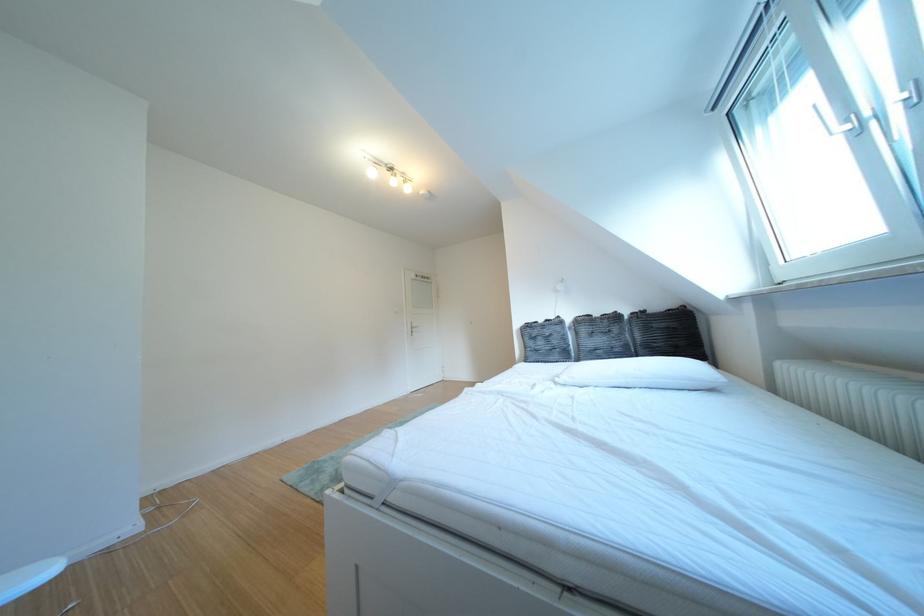
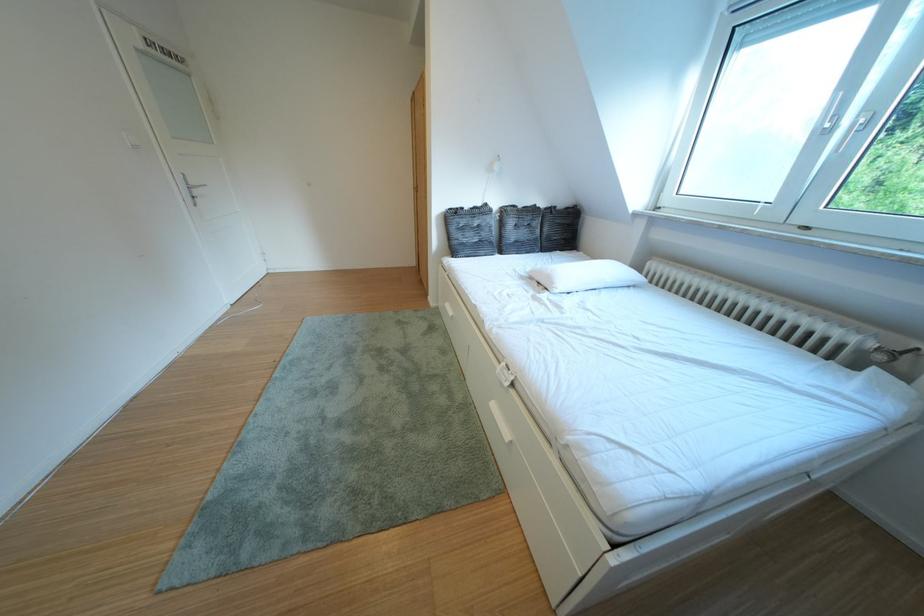
Where in the second image is the point corresponding to point (542, 355) from the first image?

(468, 246)